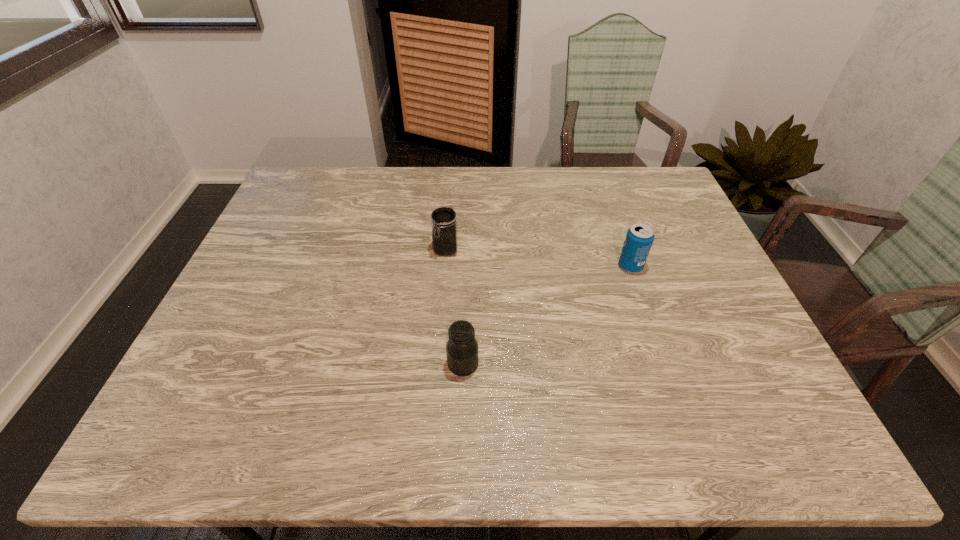
At what (x,y) coordinates should I click in order to perform the action: click on soda can. Please return your answer as a coordinate pair (x, y). This screenshot has height=540, width=960. Looking at the image, I should click on (639, 238).

Find the location of `the farther jar`. the farther jar is located at coordinates click(x=444, y=226).

This screenshot has height=540, width=960. Identify the location of the nearest object. (462, 348).

Identify the location of vacant space located on the back of the soda can. Image resolution: width=960 pixels, height=540 pixels. (613, 217).

Locate an element on the screen. The width and height of the screenshot is (960, 540). free space located 0.350m on the lid of the farther jar is located at coordinates (437, 367).

Where is `free space located on the right of the nearer jar`? This screenshot has height=540, width=960. free space located on the right of the nearer jar is located at coordinates (653, 364).

Find the location of `free space at the far edge of the desktop`. free space at the far edge of the desktop is located at coordinates (590, 168).

Where is `vacant space at the near edge`? vacant space at the near edge is located at coordinates (333, 435).

Identify the location of vacant space at the left edge of the desktop. (285, 241).

At what (x,y) coordinates should I click in order to perform the action: click on vacant area at the right edge of the desktop. Please return your answer as a coordinate pair (x, y). This screenshot has height=540, width=960. Looking at the image, I should click on (692, 267).